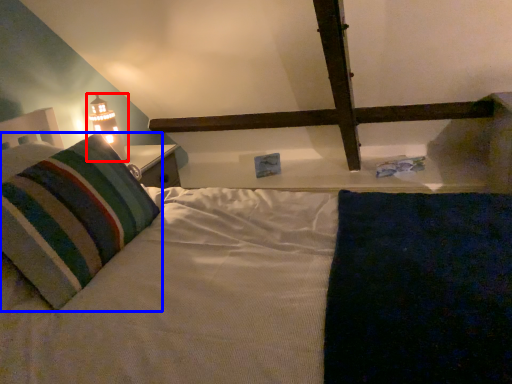
Question: Among these objects, which one is nearest to the camera, table lamp (highlighted by a red box) or pillow (highlighted by a blue box)?

Choices:
 (A) table lamp
 (B) pillow

Answer: (B)